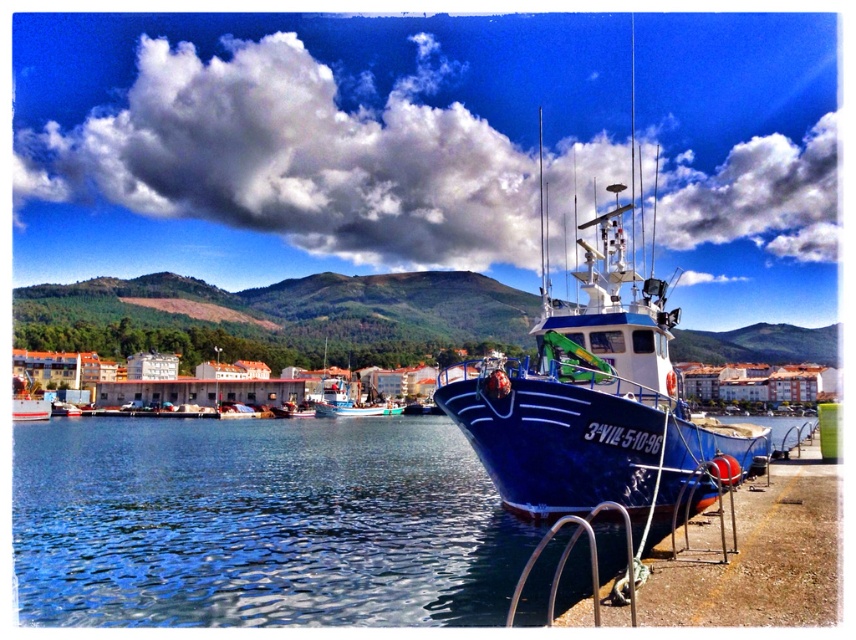
You are standing on the dock and want to locate the blue water at lower center. According to the coordinates given, where should you look?

The blue water at lower center is located at point coordinates (259, 524).

You are a small kayak that is 1.5 meters wide. You want to paddle between the blue water at lower center and the white glossy boat at lower left. Can you fit through the space between them?

The blue water at lower center might be wider than white glossy boat at lower left, so it is possible that the space between them is wide enough for the kayak to pass through. However, without exact measurements, there is some uncertainty.

You are standing on the pier and see the blue water at lower center and the white glossy boat at lower left. Which object is closer to you?

The blue water at lower center is closer to you because it is in front of the white glossy boat at lower left.